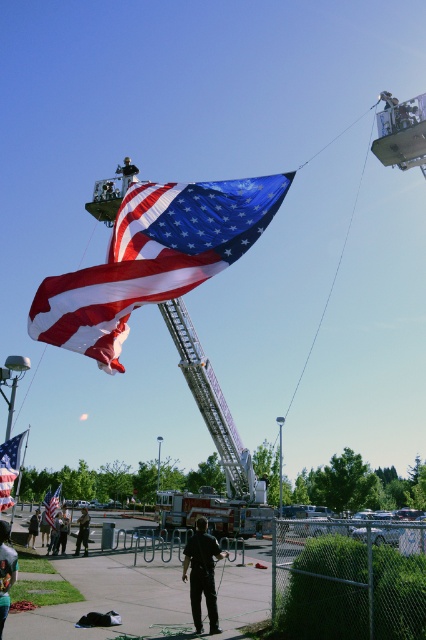
Is black uniformed person at upper center thinner than dark brown leather jacket at lower left?

Yes.

Does black uniformed person at upper center appear under dark brown leather jacket at lower left?

No, black uniformed person at upper center is not below dark brown leather jacket at lower left.

Is point (121, 186) positioned after point (39, 520)?

No.

The width and height of the screenshot is (426, 640). In order to click on black uniformed person at upper center in this screenshot , I will do `click(126, 173)`.

Which is above, black matte person at center or dark gray uniform at center?

black matte person at center is higher up.

Is point (5, 573) in front of point (66, 515)?

Yes, point (5, 573) is closer to viewer.

Locate an element on the screen. The width and height of the screenshot is (426, 640). black matte person at center is located at coordinates (5, 572).

Between point (126, 164) and point (51, 522), which one is positioned behind?

Positioned behind is point (51, 522).

Is black uniformed person at upper center positioned at the back of matte red flag at center?

No, black uniformed person at upper center is closer to the viewer.

This screenshot has width=426, height=640. I want to click on black uniformed person at upper center, so click(x=126, y=173).